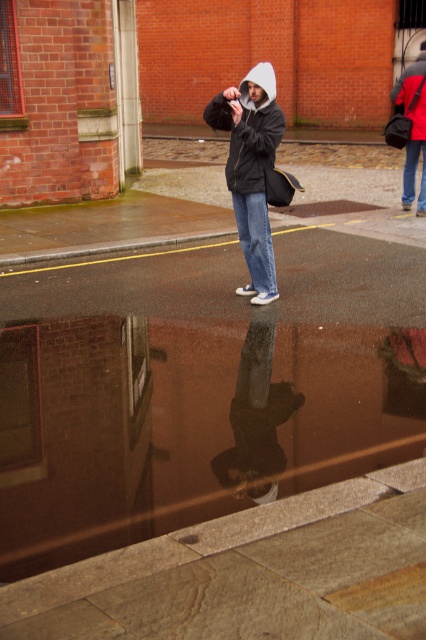
You are a photographer trying to capture both the smooth black jacket at center and the matte black jacket at center in the same frame. Given that your camera has a depth of field that can focus on objects within 2 meters, will both jackets be in focus?

The smooth black jacket at center is 2.39 meters away from matte black jacket at center. Since the distance between them exceeds the camera lens depth of field range of 2 meters, only one of the jackets will be in focus at a time.

You are a fashion designer observing a model wearing two jackets. The model has a smooth black jacket at center and a matte black jacket at center. Which jacket would you recommend for a rainy day to keep the model dry?

The smooth black jacket at center is thinner than the matte black jacket at center, so the matte black jacket at center would be more suitable for a rainy day as it offers better protection against the rain.

You are a photographer trying to capture the reflection of the matte black bag at upper right and the blue denim jeans at lower right in the puddle. Which object will have a larger reflection in the puddle?

The matte black bag at upper right will have a larger reflection in the puddle because it is taller than the blue denim jeans at lower right.